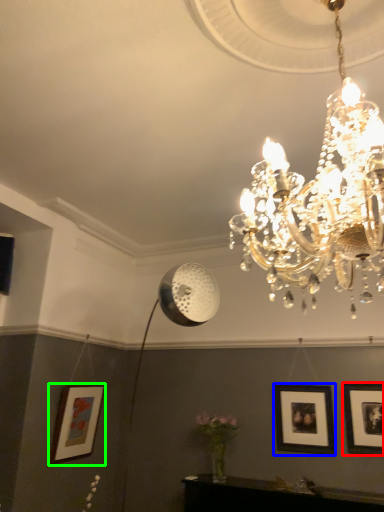
Question: Considering the real-world distances, which object is closest to picture frame (highlighted by a red box)? picture frame (highlighted by a blue box) or picture frame (highlighted by a green box).

Choices:
 (A) picture frame
 (B) picture frame

Answer: (A)